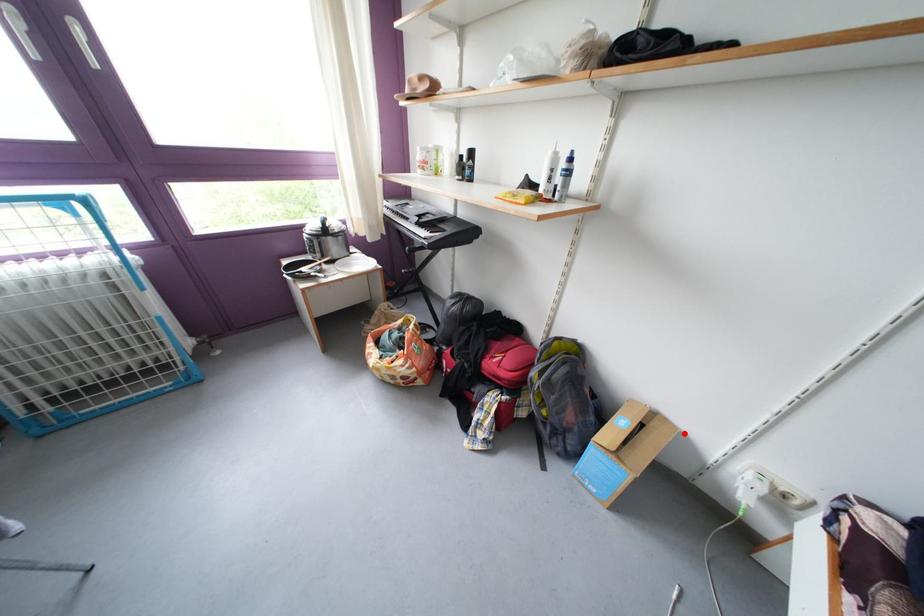
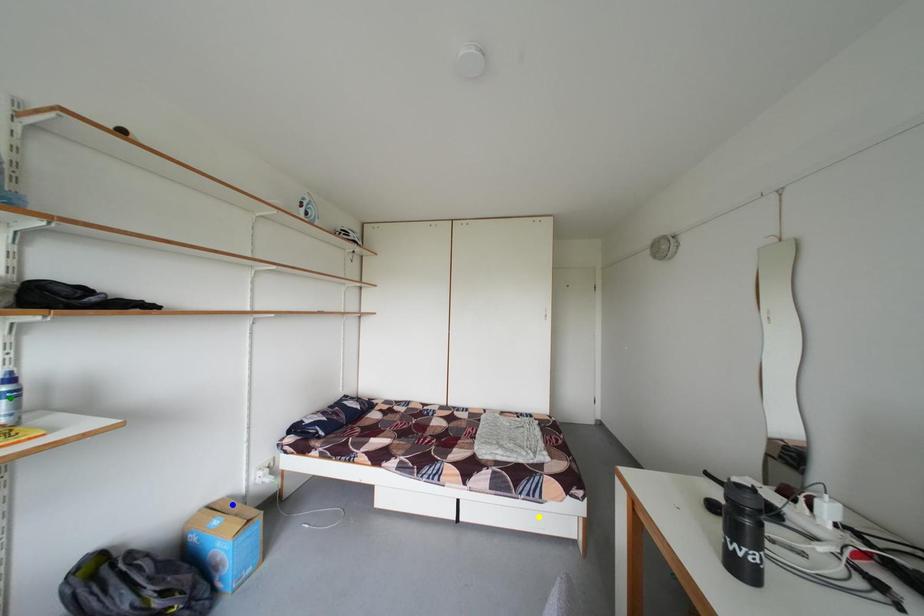
Question: I am providing you with two images of the same scene from different viewpoints. A red point is marked on the first image. You are given multiple points on the second image. Which point in image 2 is actually the same real-world point as the red point in image 1?

Choices:
 (A) green point
 (B) yellow point
 (C) blue point

Answer: (C)